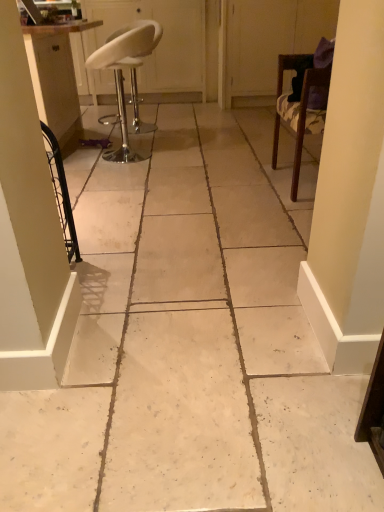
Question: Relative to wooden chair at right, arranged as the 1th chair when viewed from the right, is white leather stool at upper left, the 1th screen door viewed from the left, in front or behind?

Choices:
 (A) behind
 (B) front

Answer: (A)

Question: Considering the positions of point (109, 102) and point (312, 71), is point (109, 102) closer or farther from the camera than point (312, 71)?

Choices:
 (A) closer
 (B) farther

Answer: (B)

Question: Based on their relative distances, which object is nearer to the white leather stool at upper left, the 1th screen door viewed from the left?

Choices:
 (A) matte white cabinet at left
 (B) transparent plastic screen door at upper right, the 1th screen door positioned from the right
 (C) wooden chair at right, which is counted as the 2th chair, starting from the left
 (D) white leather stool at upper left, placed as the 1th chair when sorted from left to right

Answer: (B)

Question: Based on their relative distances, which object is nearer to the matte white cabinet at left?

Choices:
 (A) white leather stool at upper left, the 2th screen door in the right-to-left sequence
 (B) transparent plastic screen door at upper right, the 1th screen door positioned from the right
 (C) wooden chair at right, arranged as the 1th chair when viewed from the right
 (D) white leather stool at upper left, acting as the 2th chair starting from the right

Answer: (D)